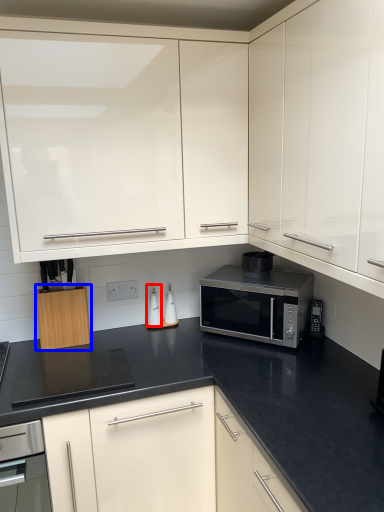
Question: Which object is closer to the camera taking this photo, appliance (highlighted by a red box) or cabinetry (highlighted by a blue box)?

Choices:
 (A) appliance
 (B) cabinetry

Answer: (B)